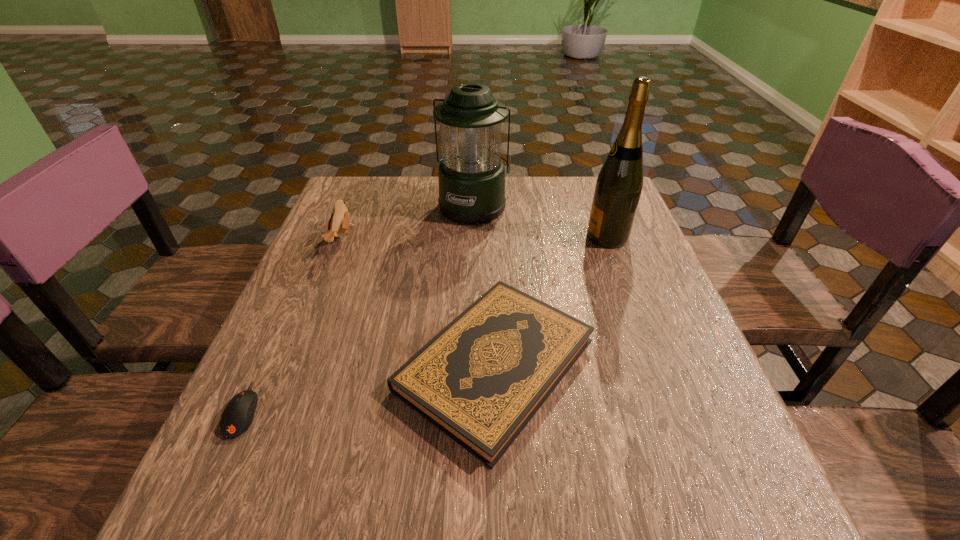
This screenshot has height=540, width=960. I want to click on free point located 0.300m on the front-facing side of the tallest object, so click(x=470, y=237).

This screenshot has height=540, width=960. Find the location of `vacant space positioned 0.250m on the left of the fourth shortest object`. vacant space positioned 0.250m on the left of the fourth shortest object is located at coordinates (350, 206).

Where is `vacant space located 0.060m at the beak of the bird`? The image size is (960, 540). vacant space located 0.060m at the beak of the bird is located at coordinates (375, 241).

Identify the location of free space located on the front of the second shortest object. The width and height of the screenshot is (960, 540). (500, 511).

Locate an element on the screen. This screenshot has height=540, width=960. blank space located on the back of the shortest object is located at coordinates (311, 264).

I want to click on object at the far edge, so click(x=471, y=174).

Identify the location of bird that is at the left edge. (339, 222).

Locate an element on the screen. computer mouse that is at the left edge is located at coordinates (237, 417).

Locate an element on the screen. object that is at the right edge is located at coordinates (618, 188).

Find the location of a particular element. This screenshot has width=960, height=540. free space at the far edge is located at coordinates (403, 187).